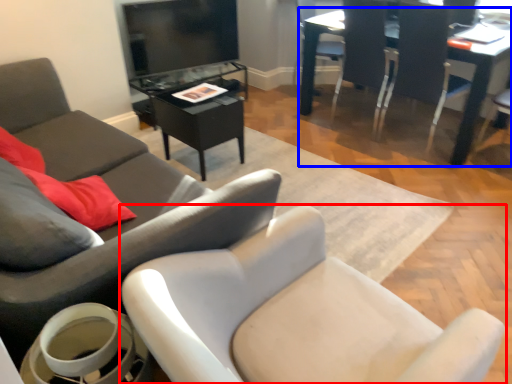
Question: Among these objects, which one is farthest to the camera, chair (highlighted by a red box) or table (highlighted by a blue box)?

Choices:
 (A) chair
 (B) table

Answer: (B)